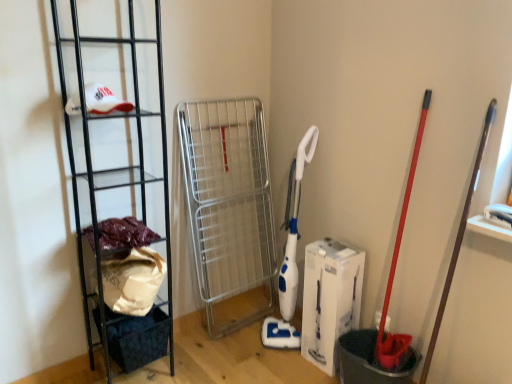
Locate an element on the screen. This screenshot has height=384, width=512. vacant space to the right of black metal rack at left is located at coordinates (201, 359).